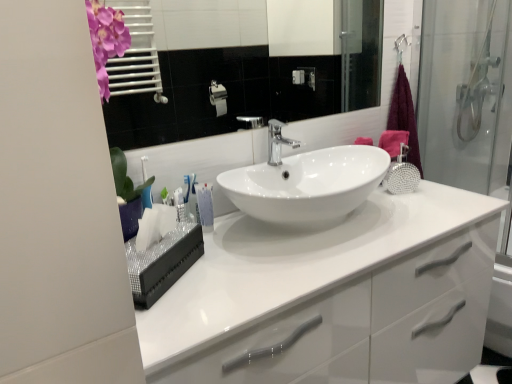
Identify the location of white glossy cabinet at center. This screenshot has height=384, width=512. pyautogui.click(x=369, y=325).

The image size is (512, 384). Describe the element at coordinates (404, 116) in the screenshot. I see `purple fabric towel at right` at that location.

What is the approximate height of purple fabric towel at right?

purple fabric towel at right is 19.02 inches tall.

Identify the location of white glossy mirror at upper center. (241, 70).

Image resolution: width=512 pixels, height=384 pixels. Find the location of `white glossy tube at center`. white glossy tube at center is located at coordinates (205, 207).

Is white glossy tube at center wider or thinner than white glossy mirror at upper center?

white glossy tube at center is wider than white glossy mirror at upper center.

Considering the points (206, 204) and (263, 68), which point is in front, point (206, 204) or point (263, 68)?

The point (206, 204) is in front.

Which is correct: white glossy tube at center is inside white glossy mirror at upper center, or outside of it?

white glossy tube at center is outside white glossy mirror at upper center.

From a real-world perspective, which is physically below, white glossy tube at center or white glossy mirror at upper center?

white glossy tube at center is physically lower.

Looking at this image, from the image's perspective, is polished chrome tap at center located above white glossy tube at center?

Yes, from the image's perspective, polished chrome tap at center is on top of white glossy tube at center.

Are polished chrome tap at center and white glossy tube at center located far from each other?

Actually, polished chrome tap at center and white glossy tube at center are a little close together.

From a real-world perspective, does polished chrome tap at center stand above white glossy tube at center?

Indeed, from a real-world perspective, polished chrome tap at center stands above white glossy tube at center.

You are a GUI agent. You are given a task and a screenshot of the screen. Output one action in this format:
    pyautogui.click(x=<x>, y=<y>)
    Task: Click on the toothpaste to the left of polished chrome tap at center
    
    Given the screenshot: What is the action you would take?
    pyautogui.click(x=205, y=207)

Does pink fabric bath towel at upper right turn towards white glossy mirror at upper center?

No, pink fabric bath towel at upper right is not turned towards white glossy mirror at upper center.

Which of these two, pink fabric bath towel at upper right or white glossy mirror at upper center, stands taller?

With more height is white glossy mirror at upper center.

Is point (389, 143) farther from viewer compared to point (144, 143)?

No, (389, 143) is closer to viewer.

Which object is further away from the camera, pink fabric bath towel at upper right or white glossy mirror at upper center?

pink fabric bath towel at upper right is behind.

From the image's perspective, would you say purple fabric towel at right is positioned over pink fabric bath towel at upper right?

Yes, from the image's perspective, purple fabric towel at right is on top of pink fabric bath towel at upper right.

Would you say pink fabric bath towel at upper right is part of purple fabric towel at right's contents?

Actually, pink fabric bath towel at upper right is outside purple fabric towel at right.

Is white glossy tube at center positioned with its back to white glossy cabinet at center?

white glossy tube at center is not turned away from white glossy cabinet at center.

Is white glossy tube at center situated inside white glossy cabinet at center or outside?

white glossy tube at center is not inside white glossy cabinet at center, it's outside.

Can you confirm if white glossy tube at center is thinner than white glossy cabinet at center?

Yes, white glossy tube at center is thinner than white glossy cabinet at center.

Locate an element on the screen. bath towel that is above the polished chrome tap at center (from the image's perspective) is located at coordinates (393, 142).

Between pink fabric bath towel at upper right and polished chrome tap at center, which one is positioned behind?

pink fabric bath towel at upper right is behind.

Is point (406, 135) closer or farther from the camera than point (268, 129)?

Point (406, 135) appears to be farther away from the viewer than point (268, 129).

Could you tell me if pink fabric bath towel at upper right is turned towards purple fabric towel at right?

No.

From the image's perspective, which is above, pink fabric bath towel at upper right or purple fabric towel at right?

purple fabric towel at right.

Considering the sizes of pink fabric bath towel at upper right and purple fabric towel at right in the image, is pink fabric bath towel at upper right wider or thinner than purple fabric towel at right?

Considering their sizes, pink fabric bath towel at upper right looks slimmer than purple fabric towel at right.

You are a GUI agent. You are given a task and a screenshot of the screen. Output one action in this format:
    pyautogui.click(x=<x>, y=<y>)
    Task: Click on the toothpaste on the left side of white glossy mirror at upper center
    The width and height of the screenshot is (512, 384).
    Given the screenshot: What is the action you would take?
    pyautogui.click(x=205, y=207)

Where is `tap on the right of the white glossy tube at center`? Image resolution: width=512 pixels, height=384 pixels. tap on the right of the white glossy tube at center is located at coordinates (277, 142).

Based on their spatial positions, is white glossy cabinet at center or pink fabric bath towel at upper right further from white glossy tube at center?

pink fabric bath towel at upper right is positioned further to the anchor white glossy tube at center.

From the image, which object appears to be nearer to white glossy tube at center, white glossy mirror at upper center or white glossy cabinet at center?

white glossy cabinet at center lies closer to white glossy tube at center than the other object.

Looking at the image, which one is located closer to white glossy mirror at upper center, white glossy tube at center or pink fabric bath towel at upper right?

pink fabric bath towel at upper right.

Which object lies further to the anchor point white glossy mirror at upper center, purple fabric towel at right or white glossy tube at center?

Among the two, white glossy tube at center is located further to white glossy mirror at upper center.

Considering their positions, is purple fabric towel at right positioned further to white glossy tube at center than pink fabric bath towel at upper right?

purple fabric towel at right.

Looking at this image, when comparing their distances from white glossy tube at center, does polished chrome tap at center or purple fabric towel at right seem further?

Among the two, purple fabric towel at right is located further to white glossy tube at center.

Considering their positions, is white glossy cabinet at center positioned closer to pink fabric bath towel at upper right than white glossy tube at center?

white glossy cabinet at center lies closer to pink fabric bath towel at upper right than the other object.

Looking at the image, which one is located further to white glossy tube at center, white glossy mirror at upper center or purple fabric towel at right?

The object further to white glossy tube at center is white glossy mirror at upper center.

Locate an element on the screen. This screenshot has width=512, height=384. bath towel between white glossy mirror at upper center and purple fabric towel at right is located at coordinates (393, 142).

This screenshot has height=384, width=512. Identify the location of tap between white glossy cabinet at center and purple fabric towel at right along the z-axis. pyautogui.click(x=277, y=142).

Where is `mirror between white glossy tube at center and purple fabric towel at right from left to right`? The width and height of the screenshot is (512, 384). mirror between white glossy tube at center and purple fabric towel at right from left to right is located at coordinates (241, 70).

I want to click on tap between white glossy tube at center and purple fabric towel at right, so click(277, 142).